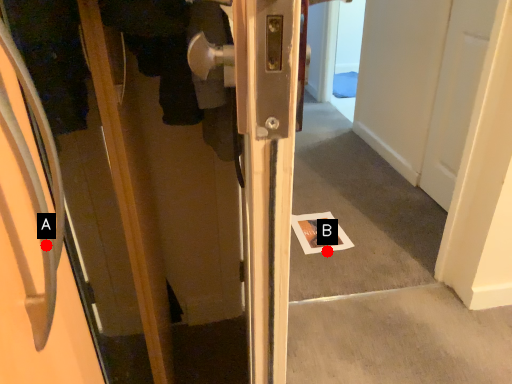
Question: Two points are circled on the image, labeled by A and B beside each circle. Which point is farther to the camera?

Choices:
 (A) A is further
 (B) B is further

Answer: (B)